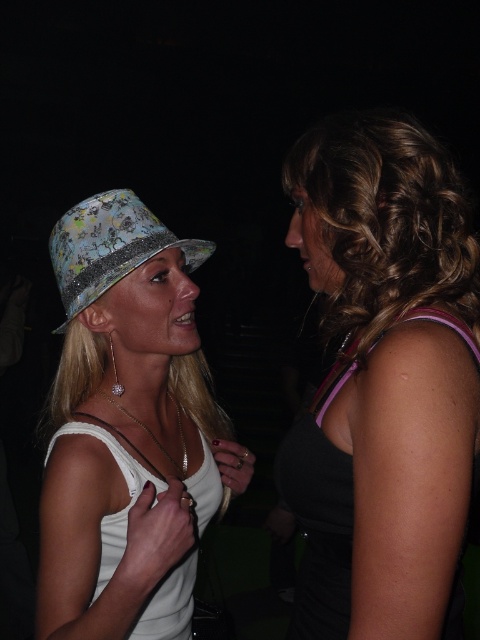
You are at a party and see two people talking. The person on the left has a shiny floral hat at left and a glittery floral hat at left. Which hat is wider?

The shiny floral hat at left is wider than the glittery floral hat at left.

You are a photographer at a fashion event. You need to capture a closeup shot of the glittery floral hat at left and the shiny black dress at right. The camera can only focus on objects within 40 centimeters of each other. Can you take the photo without moving either object?

The shiny black dress at right is 39.19 centimeters from the glittery floral hat at left, which is within the 40 centimeter range. Therefore, the camera can focus on both objects without needing to move them.